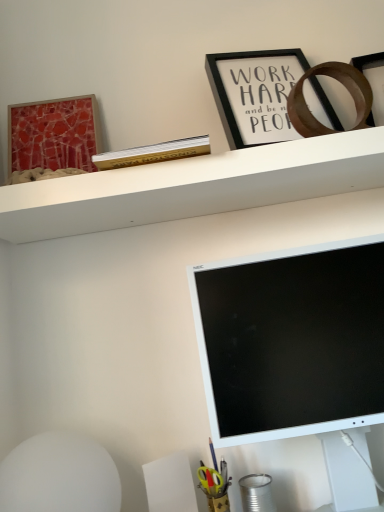
Question: In the image, is metallic tin can at lower right positioned in front of or behind white matte shelf at upper center?

Choices:
 (A) behind
 (B) front

Answer: (A)

Question: Is metallic tin can at lower right inside the boundaries of white matte shelf at upper center, or outside?

Choices:
 (A) outside
 (B) inside

Answer: (A)

Question: Considering the real-world distances, which object is farthest from the white matte computer monitor at lower right?

Choices:
 (A) matte red picture frame at upper left, acting as the second picture frame starting from the right
 (B) black matte picture frame at upper center, placed as the second picture frame when sorted from left to right
 (C) metallic tin can at lower right
 (D) white matte shelf at upper center

Answer: (A)

Question: Estimate the real-world distances between objects in this image. Which object is closer to the white matte computer monitor at lower right?

Choices:
 (A) matte red picture frame at upper left, acting as the second picture frame starting from the right
 (B) white matte shelf at upper center
 (C) metallic tin can at lower right
 (D) black matte picture frame at upper center, the first picture frame when ordered from right to left

Answer: (B)